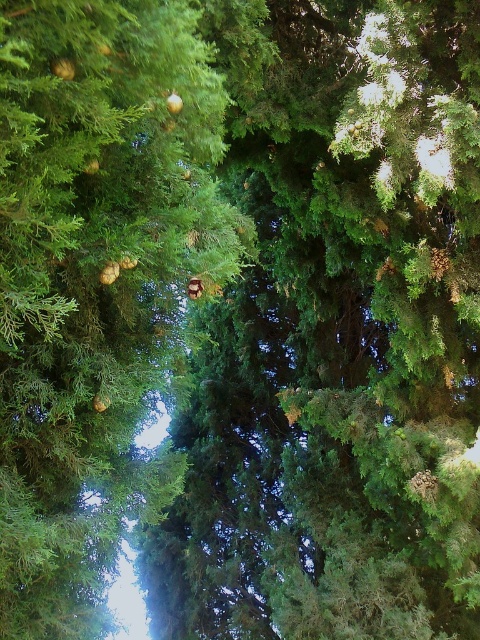
You are a bird perched on a branch and want to fly to the green textured pine tree at center from the green matte pine cone at upper center. Which direction should you fly to reach the pine tree?

The green textured pine tree at center is to the right of the green matte pine cone at upper center, so the bird should fly to the right to reach the pine tree.

You are a bird looking for a place to perch. You see the green textured pine tree at center and the green matte pine cone at upper center. Which one is taller?

The green textured pine tree at center is much taller than the green matte pine cone at upper center, so the pine tree is taller.

You are standing in front of a lush evergreen tree and want to take a photo of a specific point in the scene. The point you want to capture is labeled as point (431, 628). If you need to focus your camera at exactly 5.00 meters to capture this point clearly, will the camera focus correctly on the point?

The distance of point (431, 628) from the camera is exactly 5.00 meters, so the camera will focus correctly on the point when set to 5.00 meters.